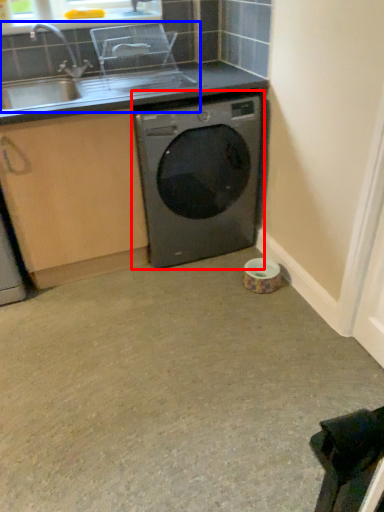
Question: Among these objects, which one is nearest to the camera, washing machine (highlighted by a red box) or sink (highlighted by a blue box)?

Choices:
 (A) washing machine
 (B) sink

Answer: (B)